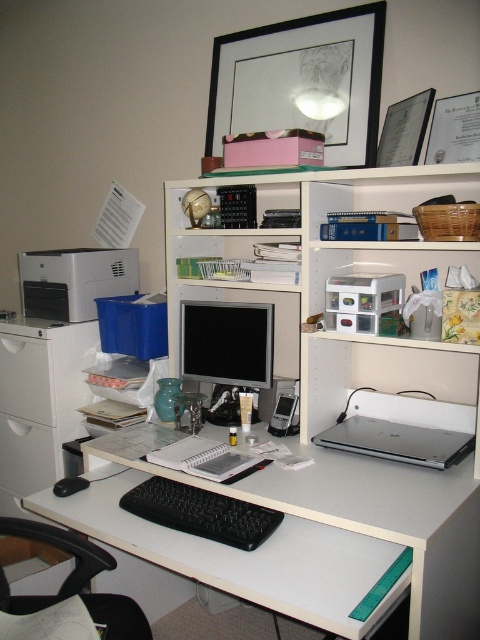
Question: Among these objects, which one is nearest to the camera?

Choices:
 (A) white plastic drawers at upper center
 (B) white plastic computer desk at center
 (C) silver metallic laptop at center

Answer: (B)

Question: From the image, what is the correct spatial relationship of white plastic file cabinet at left in relation to silver metallic laptop at center?

Choices:
 (A) right
 (B) left

Answer: (B)

Question: In this image, where is black plastic calculator at center located relative to silver metallic laptop at center?

Choices:
 (A) above
 (B) below

Answer: (A)

Question: Is black plastic calculator at center in front of black matte keyboard at center?

Choices:
 (A) no
 (B) yes

Answer: (A)

Question: Among these points, which one is nearest to the camera?

Choices:
 (A) (175, 225)
 (B) (406, 428)

Answer: (B)

Question: Based on their relative distances, which object is farther from the black matte keyboard at center?

Choices:
 (A) silver metallic laptop at center
 (B) white plastic computer desk at center

Answer: (A)